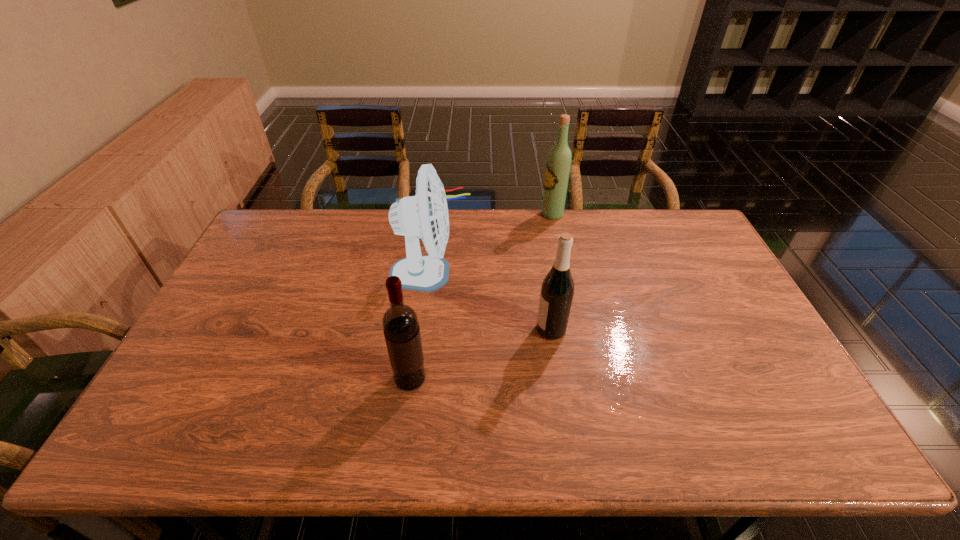
At what (x,y) coordinates should I click in order to perform the action: click on vacant space located on the label of the third farthest object. Please return your answer as a coordinate pair (x, y). Looking at the image, I should click on (458, 329).

Find the location of `vacant space located 0.280m on the label of the third farthest object`. vacant space located 0.280m on the label of the third farthest object is located at coordinates (437, 329).

This screenshot has height=540, width=960. Identify the location of free spot located 0.130m on the label of the third farthest object. (490, 329).

This screenshot has height=540, width=960. I want to click on wine bottle at the far edge, so click(558, 165).

Identify the location of fan that is at the far edge. (425, 215).

Where is `vacant position at the far edge of the desktop`? vacant position at the far edge of the desktop is located at coordinates (341, 247).

Locate an element on the screen. vacant region at the near edge of the desktop is located at coordinates (382, 454).

This screenshot has width=960, height=540. I want to click on free space at the right edge, so click(708, 252).

The image size is (960, 540). Identify the location of free space at the far right corner of the desktop. (668, 225).

Where is `vacant space in between the farthest object and the nearest wine bottle`? vacant space in between the farthest object and the nearest wine bottle is located at coordinates (481, 296).